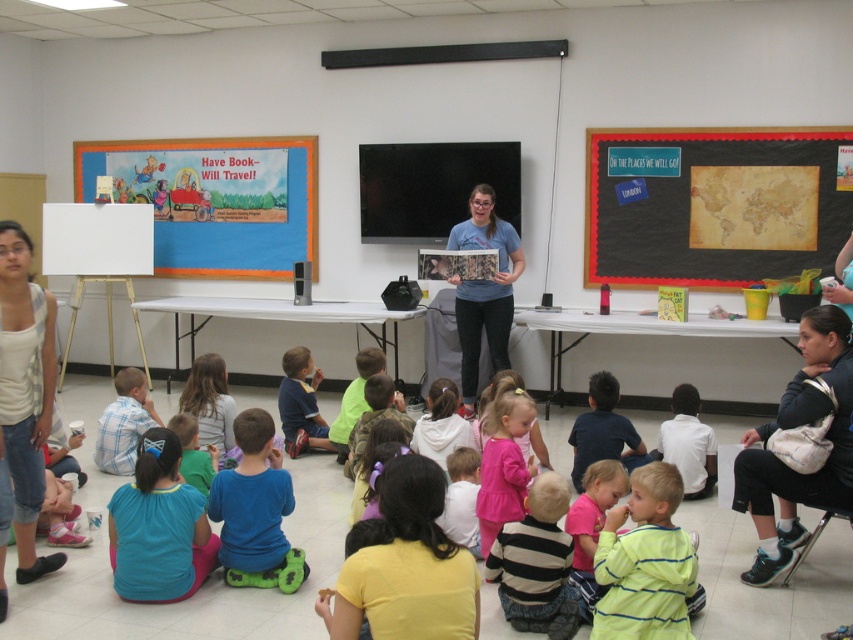
In the classroom scene, there are two girls wearing different outfits. One is wearing a white tank top at left and the other is in a pink fabric dress at center. Which girl is standing taller?

The white tank top at left is taller than the pink fabric dress at center.

Based on the photo, you are a photographer trying to capture a clear shot of both the white tank top at left and the pink fabric dress at center. Since you want to ensure both are visible, which clothing item should you focus on first to account for their size differences?

The white tank top at left is bigger than the pink fabric dress at center, so you should focus on the white tank top at left first to ensure it is clearly visible before adjusting for the smaller pink fabric dress at center.

You are a photographer taking a picture of the classroom scene. You notice the white tank top at left and the pink fabric dress at center. Which clothing item will appear larger in your photo?

The white tank top at left is closer to the viewer than the pink fabric dress at center, so it will appear larger in the photo.